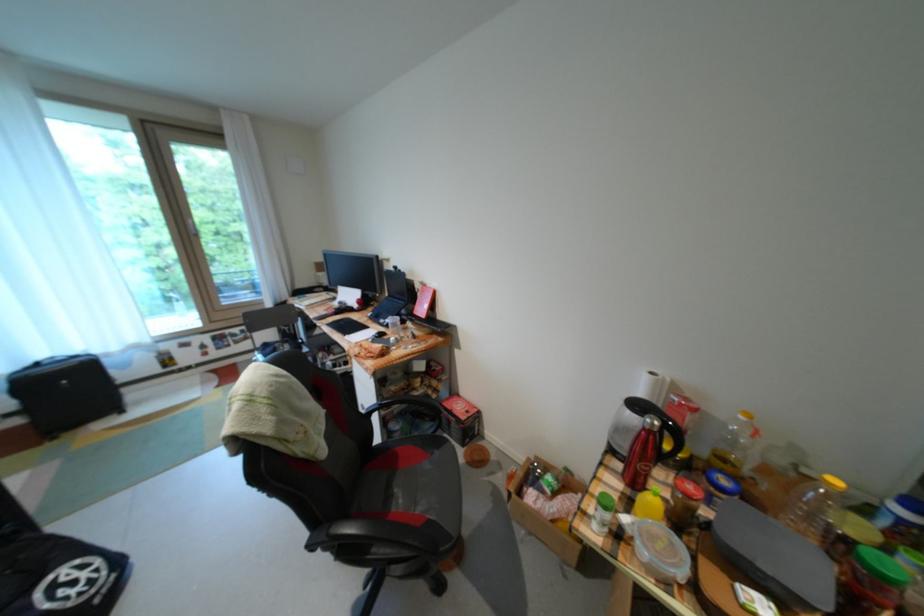
What do you see at coordinates (650, 505) in the screenshot? I see `the yellow lemon bottle` at bounding box center [650, 505].